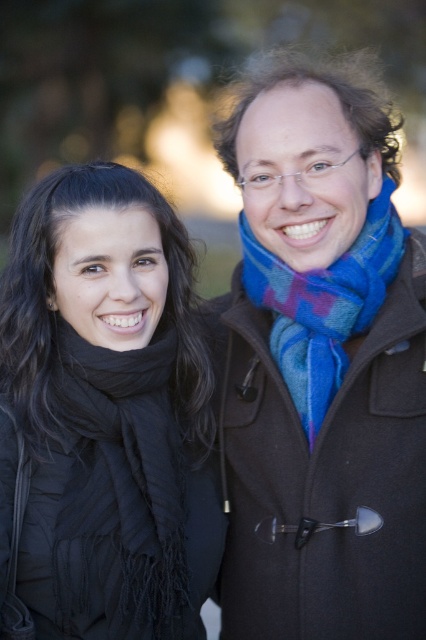
Does black soft scarf at left appear on the right side of blue woven scarf at center?

No, black soft scarf at left is not to the right of blue woven scarf at center.

Can you confirm if black soft scarf at left is positioned to the left of blue woven scarf at center?

Correct, you'll find black soft scarf at left to the left of blue woven scarf at center.

Between point (201, 355) and point (310, 300), which one is positioned in front?

Point (310, 300)

At what (x,y) coordinates should I click in order to perform the action: click on black soft scarf at left. Please return your answer as a coordinate pair (x, y). The image size is (426, 640). Looking at the image, I should click on (103, 417).

How far apart are black wool coat at right and blue woven scarf at center?

12.42 centimeters

The width and height of the screenshot is (426, 640). What are the coordinates of `black wool coat at right` in the screenshot? It's located at (324, 476).

This screenshot has height=640, width=426. What are the coordinates of `black wool coat at right` in the screenshot? It's located at (324, 476).

This screenshot has width=426, height=640. What do you see at coordinates (103, 417) in the screenshot?
I see `black soft scarf at left` at bounding box center [103, 417].

Is black soft scarf at left above black wool coat at right?

Indeed, black soft scarf at left is positioned over black wool coat at right.

You are a GUI agent. You are given a task and a screenshot of the screen. Output one action in this format:
    pyautogui.click(x=<x>, y=<y>)
    Task: Click on the black soft scarf at left
    The height and width of the screenshot is (640, 426).
    Given the screenshot: What is the action you would take?
    pyautogui.click(x=103, y=417)